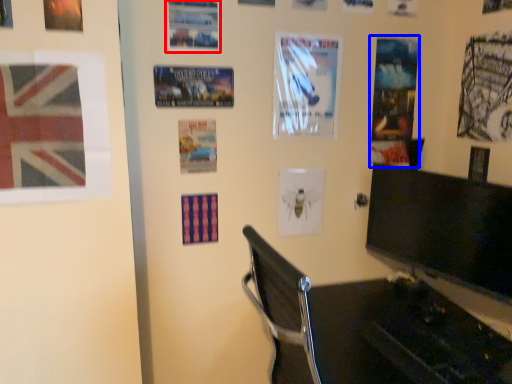
Question: Which object appears farthest to the camera in this image, poster (highlighted by a red box) or poster page (highlighted by a blue box)?

Choices:
 (A) poster
 (B) poster page

Answer: (B)